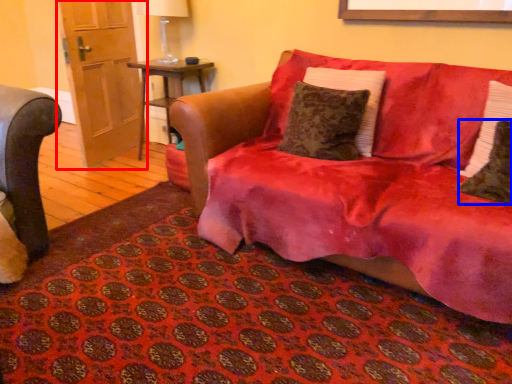
Question: Which object appears farthest to the camera in this image, door (highlighted by a red box) or pillow (highlighted by a blue box)?

Choices:
 (A) door
 (B) pillow

Answer: (A)